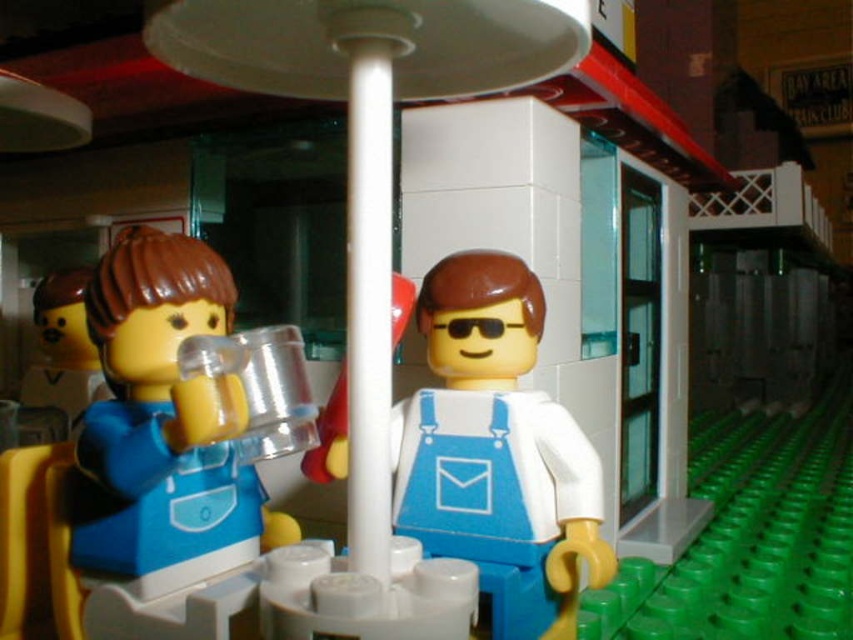
Question: Which point is closer to the camera taking this photo?

Choices:
 (A) (65, 349)
 (B) (184, 424)
 (C) (473, 484)

Answer: (B)

Question: Considering the relative positions of white matte overalls at center and translucent plastic cup at left in the image provided, where is white matte overalls at center located with respect to translucent plastic cup at left?

Choices:
 (A) above
 (B) below

Answer: (B)

Question: Which point appears farthest from the camera in this image?

Choices:
 (A) (56, 400)
 (B) (451, 339)

Answer: (A)

Question: Is white matte overalls at center behind matte plastic cup at left?

Choices:
 (A) yes
 (B) no

Answer: (B)

Question: Which object is positioned farthest from the white matte overalls at center?

Choices:
 (A) matte plastic cup at left
 (B) translucent plastic cup at left

Answer: (A)

Question: Is translucent plastic cup at left to the left of matte plastic cup at left from the viewer's perspective?

Choices:
 (A) yes
 (B) no

Answer: (B)